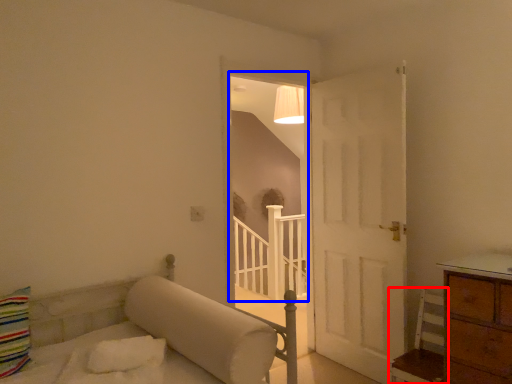
Question: Which object appears closest to the camera in this image, furniture (highlighted by a red box) or window (highlighted by a blue box)?

Choices:
 (A) furniture
 (B) window

Answer: (A)